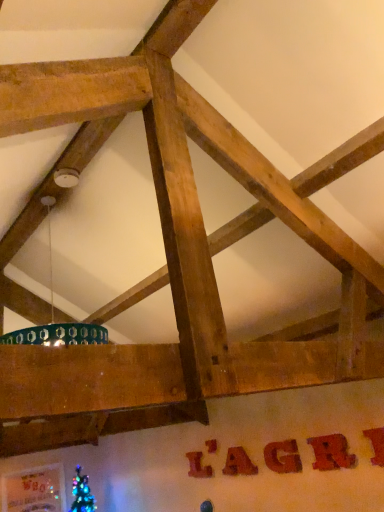
Question: From the image's perspective, would you say matte brown letter at center, the third letter from the right, is positioned over brushed wood letter at center, the sixth letter when ordered from right to left?

Choices:
 (A) no
 (B) yes

Answer: (B)

Question: From a real-world perspective, is matte brown letter at center, which appears as the 4th letter when viewed from the back, on top of brushed wood letter at center, the fifth letter from the front?

Choices:
 (A) yes
 (B) no

Answer: (B)

Question: Does matte brown letter at center, the 4th letter positioned from the left, have a lesser width compared to brushed wood letter at center, positioned as the second letter in back-to-front order?

Choices:
 (A) yes
 (B) no

Answer: (B)

Question: Considering the relative sizes of matte brown letter at center, the third letter from the right, and brushed wood letter at center, the 1th letter in the left-to-right sequence, in the image provided, is matte brown letter at center, the third letter from the right, bigger than brushed wood letter at center, the 1th letter in the left-to-right sequence,?

Choices:
 (A) yes
 (B) no

Answer: (A)

Question: Is the depth of matte brown letter at center, the third letter from the right, less than that of brushed wood letter at center, positioned as the second letter in back-to-front order?

Choices:
 (A) yes
 (B) no

Answer: (A)

Question: Is brushed wood letter at center, the fifth letter from the front, bigger or smaller than wooden sign at center, marked as the 5th letter in a left-to-right arrangement?

Choices:
 (A) big
 (B) small

Answer: (B)

Question: In the image, is brushed wood letter at center, the fifth letter from the front, positioned in front of or behind wooden sign at center, arranged as the 5th letter when viewed from the back?

Choices:
 (A) front
 (B) behind

Answer: (B)

Question: In terms of height, does brushed wood letter at center, the 1th letter in the left-to-right sequence, look taller or shorter compared to wooden sign at center, arranged as the 2th letter when viewed from the right?

Choices:
 (A) short
 (B) tall

Answer: (B)

Question: Would you say brushed wood letter at center, the sixth letter when ordered from right to left, is inside or outside wooden sign at center, arranged as the 5th letter when viewed from the back?

Choices:
 (A) outside
 (B) inside

Answer: (A)

Question: From a real-world perspective, is matte brown letter at center, the 3th letter viewed from the front, positioned above or below wooden sign at lower center, which is counted as the 4th letter, starting from the right?

Choices:
 (A) above
 (B) below

Answer: (B)

Question: From the image's perspective, is matte brown letter at center, the 4th letter positioned from the left, located above or below wooden sign at lower center, which is counted as the 4th letter, starting from the right?

Choices:
 (A) above
 (B) below

Answer: (A)

Question: Considering their positions, is matte brown letter at center, which appears as the 4th letter when viewed from the back, located in front of or behind wooden sign at lower center, which ranks as the fourth letter in front-to-back order?

Choices:
 (A) front
 (B) behind

Answer: (A)

Question: Considering the relative positions of matte brown letter at center, which appears as the 4th letter when viewed from the back, and wooden sign at lower center, which is counted as the 4th letter, starting from the right, in the image provided, is matte brown letter at center, which appears as the 4th letter when viewed from the back, to the left or to the right of wooden sign at lower center, which is counted as the 4th letter, starting from the right,?

Choices:
 (A) left
 (B) right

Answer: (B)

Question: From a real-world perspective, is wooden sign at lower center, the 3th letter viewed from the left, positioned above or below matte brown letter at center, the 4th letter positioned from the left?

Choices:
 (A) above
 (B) below

Answer: (A)

Question: Based on their positions, is wooden sign at lower center, which ranks as the fourth letter in front-to-back order, located to the left or right of matte brown letter at center, the third letter from the right?

Choices:
 (A) left
 (B) right

Answer: (A)